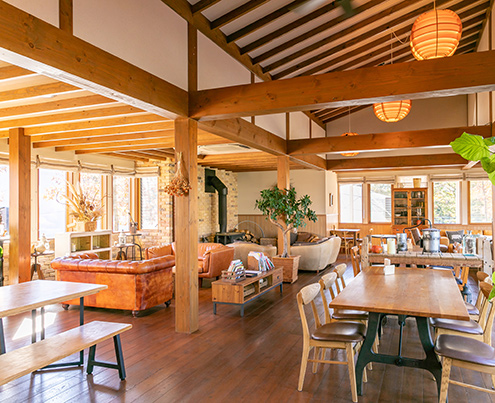
You are a GUI agent. You are given a task and a screenshot of the screen. Output one action in this format:
    pyautogui.click(x=<x>, y=<y>)
    Task: Click on the wood pillars
    This screenshot has height=403, width=495.
    Given the screenshot: What is the action you would take?
    pyautogui.click(x=24, y=216), pyautogui.click(x=193, y=219), pyautogui.click(x=281, y=181)